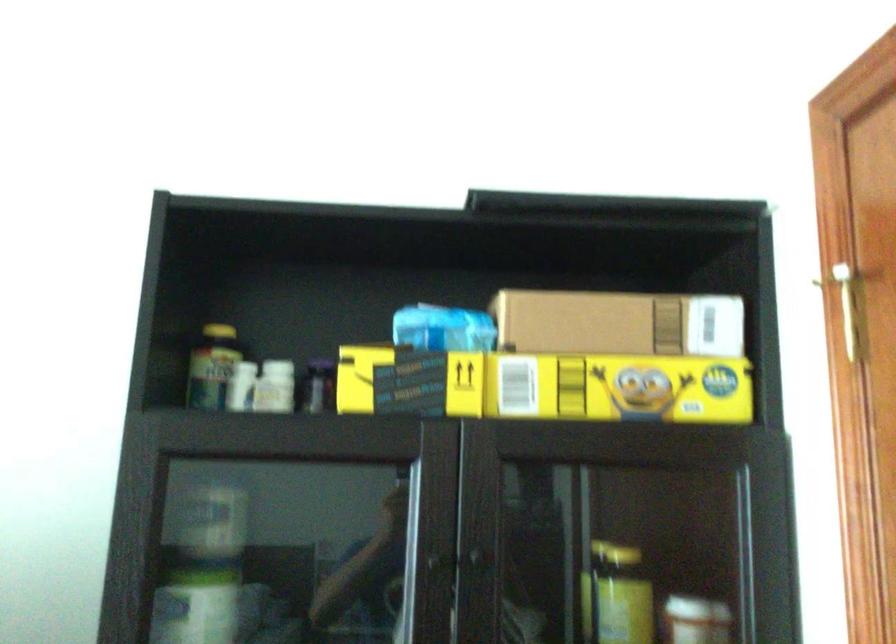
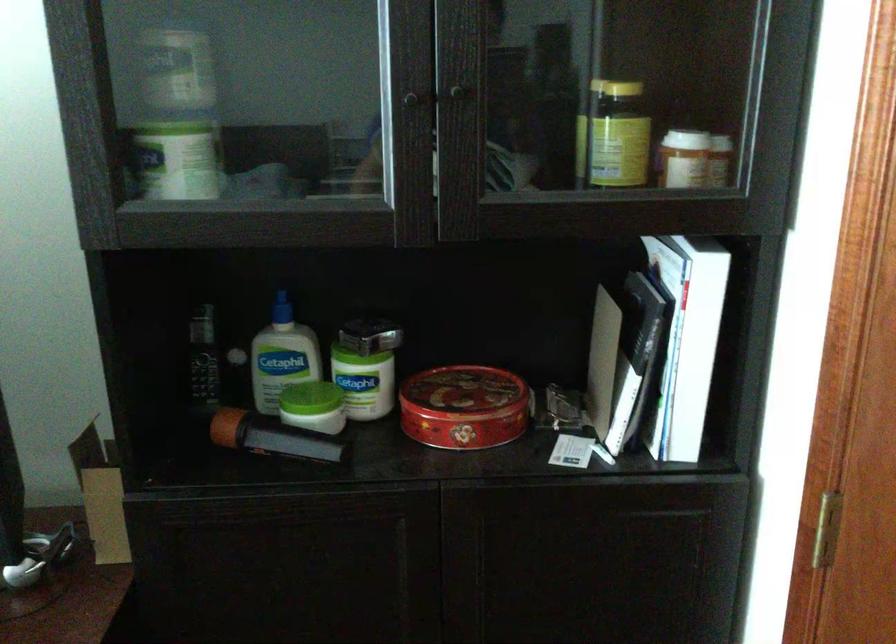
Locate, in the second image, the point that corresponds to pixel 616 553 in the first image.

(615, 89)